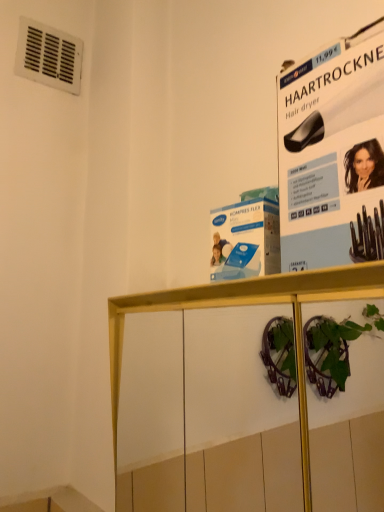
Question: From the image's perspective, is white paper at upper right positioned above or below wooden shelf at center?

Choices:
 (A) below
 (B) above

Answer: (B)

Question: From a real-world perspective, is white paper at upper right positioned above or below wooden shelf at center?

Choices:
 (A) below
 (B) above

Answer: (B)

Question: Estimate the real-world distances between objects in this image. Which object is farther from the wooden shelf at center?

Choices:
 (A) white paper at upper right
 (B) white plastic vent at upper left

Answer: (B)

Question: Estimate the real-world distances between objects in this image. Which object is closer to the white plastic vent at upper left?

Choices:
 (A) wooden shelf at center
 (B) white paper at upper right

Answer: (A)